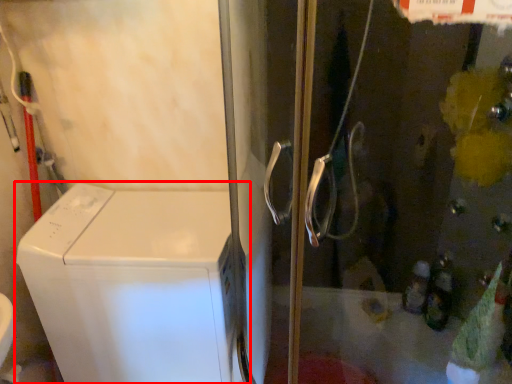
Question: From the image's perspective, what is the correct spatial relationship of home appliance (annotated by the red box) in relation to screen door?

Choices:
 (A) above
 (B) below

Answer: (B)